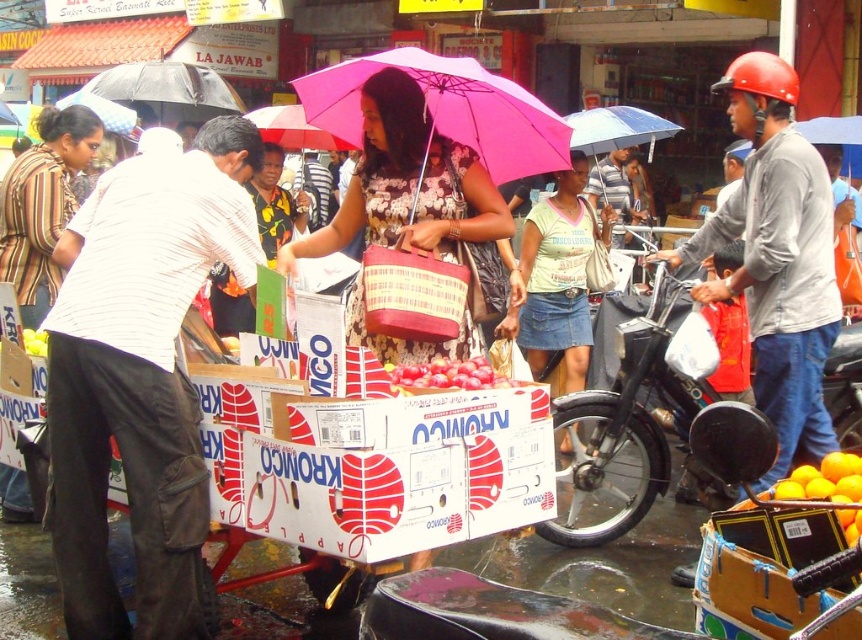
Question: Among these points, which one is farthest from the camera?

Choices:
 (A) (297, 140)
 (B) (17, 184)
 (C) (61, 104)
 (D) (478, 141)

Answer: (C)

Question: Is white striped shirt at left to the left of light green cotton shirt at center from the viewer's perspective?

Choices:
 (A) yes
 (B) no

Answer: (A)

Question: Does blue fabric umbrella at center have a lesser width compared to matte black umbrella at upper center?

Choices:
 (A) no
 (B) yes

Answer: (A)

Question: Is white striped shirt at left below pink fabric umbrella at center?

Choices:
 (A) yes
 (B) no

Answer: (A)

Question: Which point is closer to the camera taking this photo?

Choices:
 (A) (623, 433)
 (B) (55, 428)
 (C) (397, 374)
 (D) (845, 129)

Answer: (B)

Question: Estimate the real-world distances between objects in this image. Which object is closer to the white striped shirt at left?

Choices:
 (A) black matte umbrella at upper left
 (B) shiny red apples at center
 (C) orange matte at lower right
 (D) light green cotton shirt at center

Answer: (B)